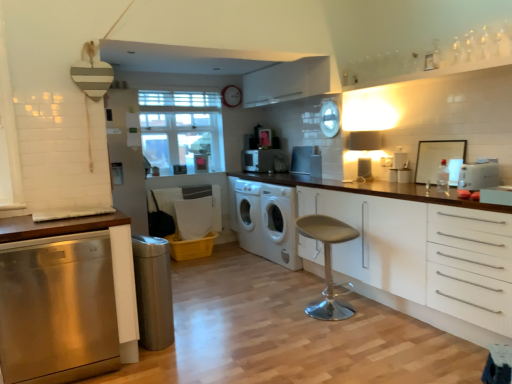
Question: Is point (115, 235) positioned closer to the camera than point (303, 170)?

Choices:
 (A) farther
 (B) closer

Answer: (B)

Question: Relative to satin silver toaster at center, the second appliance from the top, is stainless steel dishwasher at left, which appears as the second cabinetry when viewed from the right, in front or behind?

Choices:
 (A) behind
 (B) front

Answer: (B)

Question: Based on their relative distances, which object is nearer to the satin silver trash can at lower left, arranged as the 5th appliance when viewed from the right?

Choices:
 (A) white glossy microwave at center, which is the 4th appliance from right to left
 (B) white matte cabinet at right, the 2th cabinetry positioned from the left
 (C) white matte washing machine at center, the 2th washing machine viewed from the front
 (D) stainless steel dishwasher at left, arranged as the first cabinetry when viewed from the left
 (E) clear glass window at center

Answer: (D)

Question: Which object is positioned farthest from the satin silver toaster at center, the second appliance from the top?

Choices:
 (A) beige fabric stool at center
 (B) white glossy microwave at center, acting as the fifth appliance starting from the bottom
 (C) clear glass window at center
 (D) satin silver trash can at lower left, which is the fifth appliance in top-to-bottom order
 (E) stainless steel dishwasher at left, which appears as the second cabinetry when viewed from the right

Answer: (E)